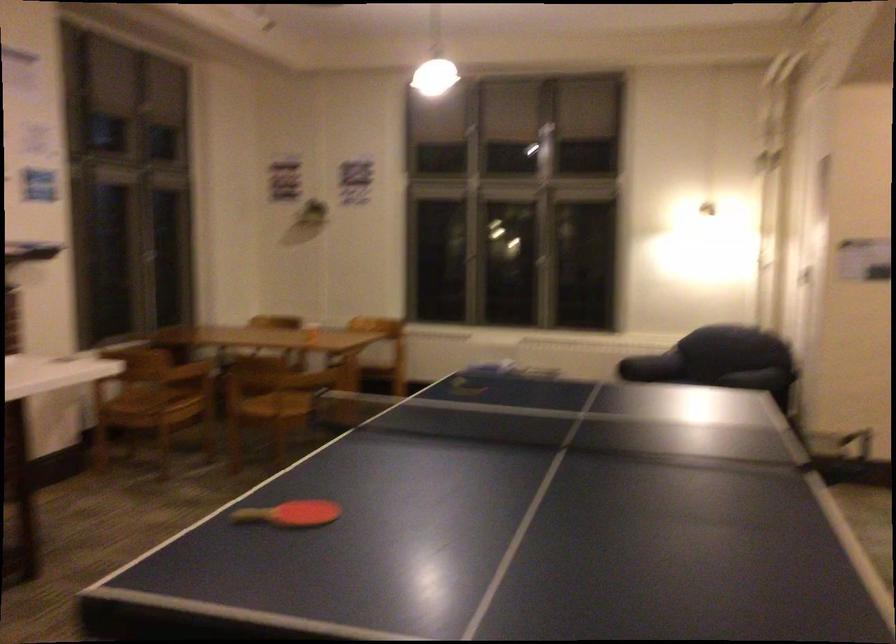
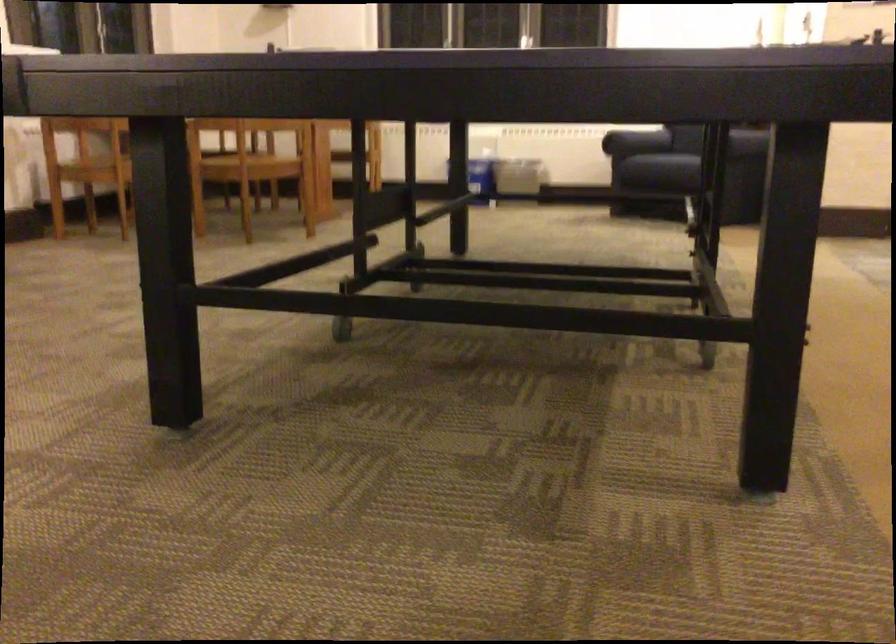
The images are taken continuously from a first-person perspective. In which direction are you moving?

The movement direction of the cameraman is right, forward.